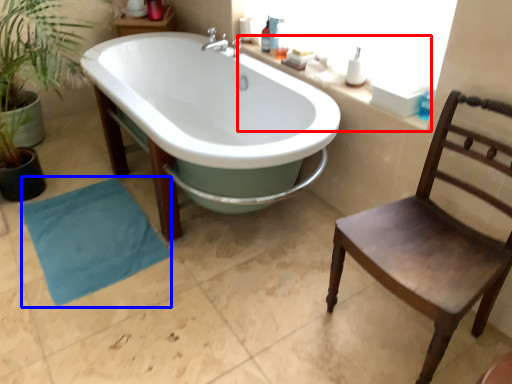
Question: Which point is closer to the camera, counter top (highlighted by a red box) or beach towel (highlighted by a blue box)?

Choices:
 (A) counter top
 (B) beach towel

Answer: (A)